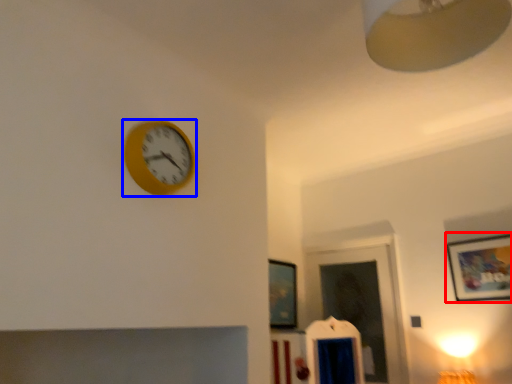
Question: Which point is further to the camera, picture frame (highlighted by a red box) or wall clock (highlighted by a blue box)?

Choices:
 (A) picture frame
 (B) wall clock

Answer: (A)